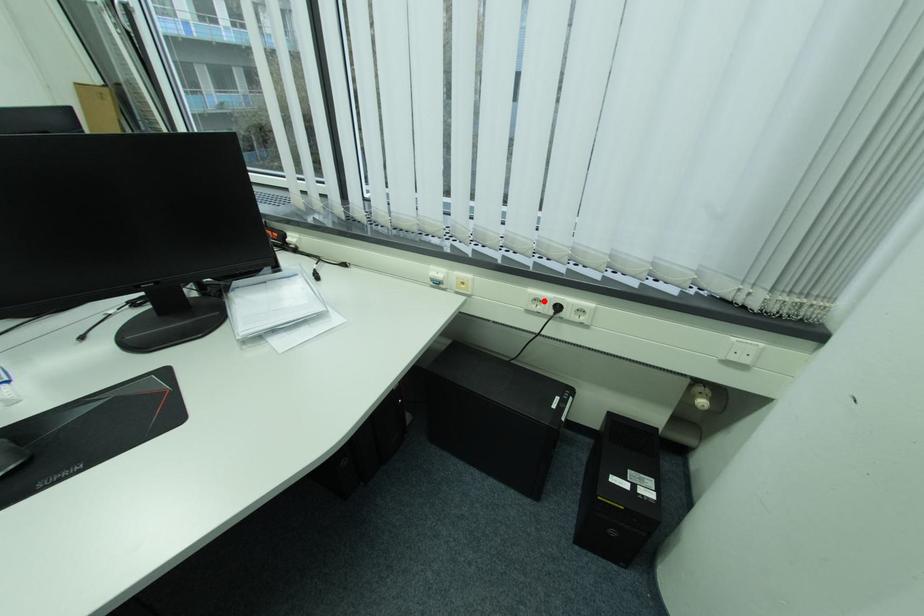
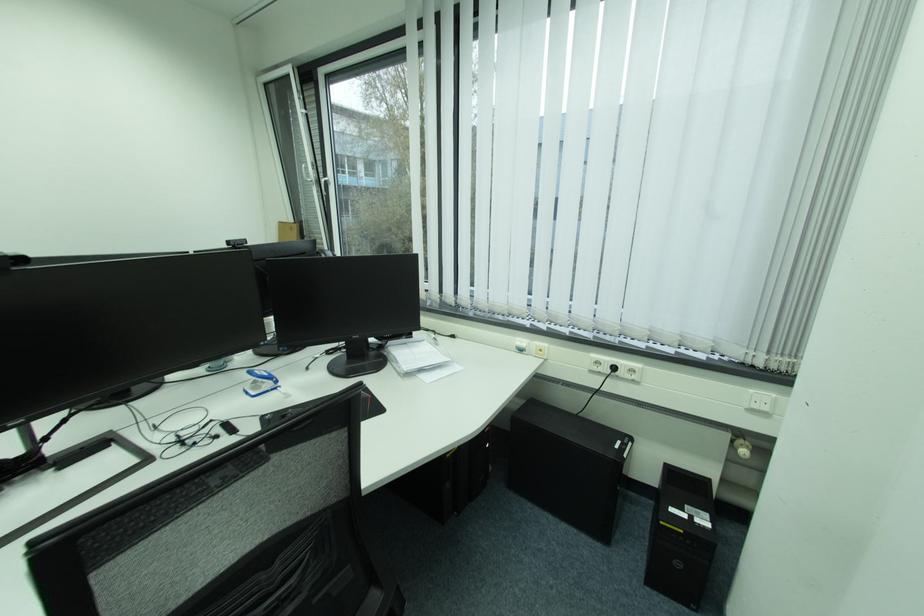
Find the pixel in the second image that matches the highlighted location in the first image.

(605, 363)